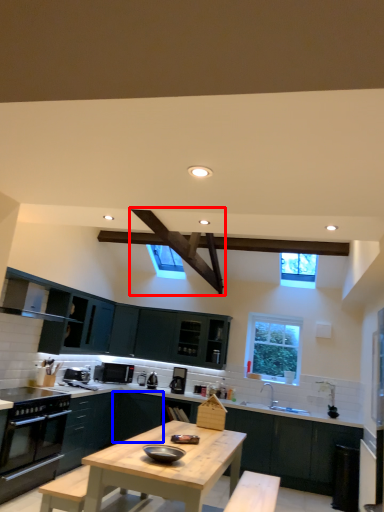
Question: Which object appears farthest to the camera in this image, exhaust hood (highlighted by a red box) or cabinetry (highlighted by a blue box)?

Choices:
 (A) exhaust hood
 (B) cabinetry

Answer: (B)